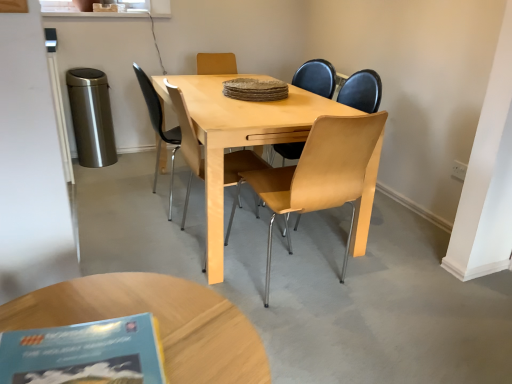
Image resolution: width=512 pixels, height=384 pixels. Identify the location of vacant space behind blue paper book at lower left. (141, 306).